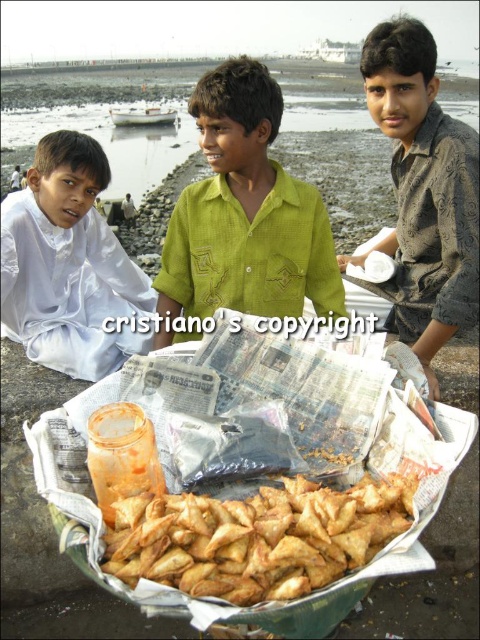
You are a photographer standing at the point with coordinates (424, 192). You want to take a picture of the patterned brown shirt at right and the samosas in the tray. Which object is closer to your current position?

The patterned brown shirt at right is closer to your current position at point (424, 192) because the Objects Description states that the point is where the shirt is located.

You are a food delivery person who needs to place the golden crispy samosa at center into a box. The box has a height limit of 10 cm. Can you determine if the samosa will fit based on its height compared to the patterned brown shirt at right?

The golden crispy samosa at center is not as tall as the patterned brown shirt at right. Since the shirt is taller than the samosa, and the box has a height limit of 10 cm, we need to know the shirt height. However, the description doesn